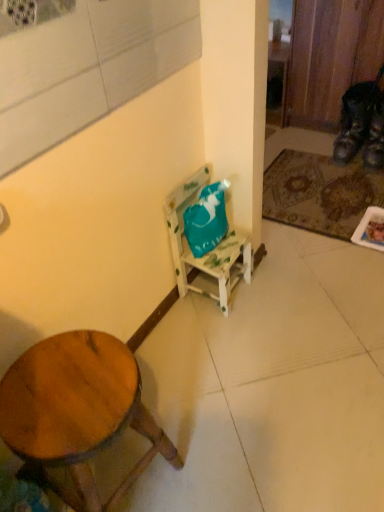
Locate an element on the screen. empty space that is in between teal fabric bag at center and wooden stool at lower left is located at coordinates (190, 360).